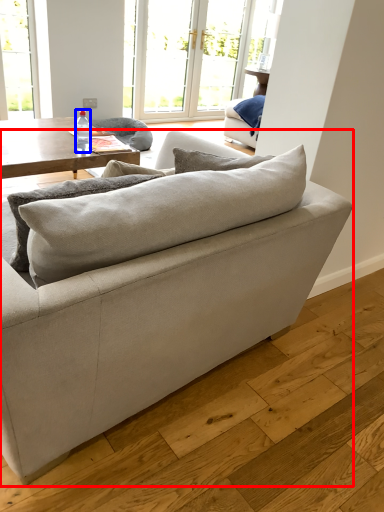
Question: Among these objects, which one is farthest to the camera, studio couch (highlighted by a red box) or bottle (highlighted by a blue box)?

Choices:
 (A) studio couch
 (B) bottle

Answer: (B)